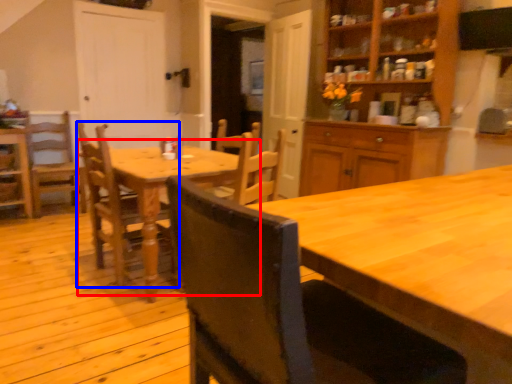
Question: Which point is further to the camera, kitchen & dining room table (highlighted by a red box) or chair (highlighted by a blue box)?

Choices:
 (A) kitchen & dining room table
 (B) chair

Answer: (B)